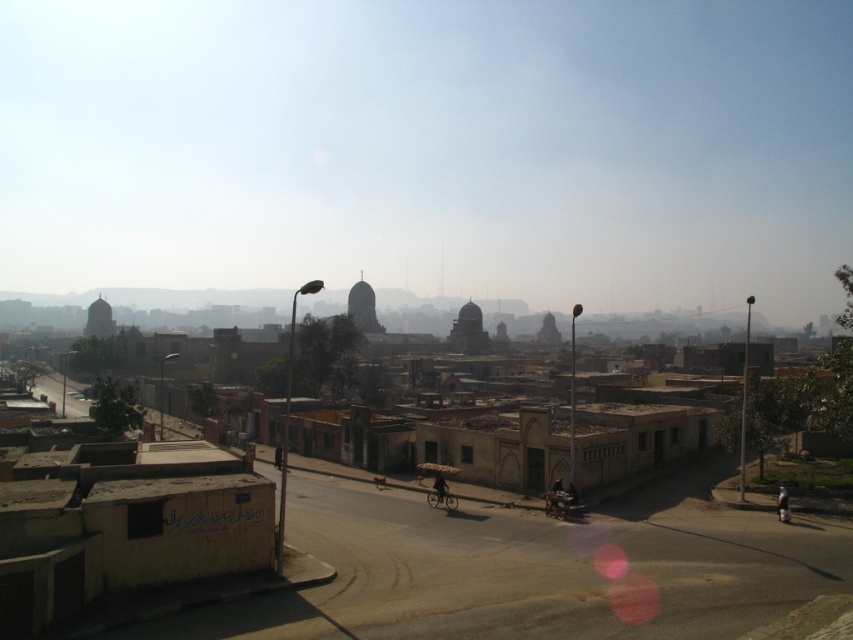
This screenshot has height=640, width=853. Find the location of `light brown fabric bag at lower right`. light brown fabric bag at lower right is located at coordinates (782, 504).

Between point (779, 500) and point (281, 461), which one is positioned in front?

Positioned in front is point (779, 500).

You are a GUI agent. You are given a task and a screenshot of the screen. Output one action in this format:
    pyautogui.click(x=<x>, y=<y>)
    Task: Click on the light brown fabric bag at lower right
    The width and height of the screenshot is (853, 640).
    Given the screenshot: What is the action you would take?
    pyautogui.click(x=782, y=504)

Does light brown fabric bag at lower right have a greater width compared to dark blue fabric bicycle at center?

No, light brown fabric bag at lower right is not wider than dark blue fabric bicycle at center.

Is point (786, 516) positioned behind point (437, 499)?

No, it is in front of (437, 499).

Between point (782, 508) and point (440, 490), which one is positioned in front?

Point (782, 508) is more forward.

Identify the location of light brown fabric bag at lower right. The image size is (853, 640). (782, 504).

This screenshot has width=853, height=640. Describe the element at coordinates (440, 486) in the screenshot. I see `dark blue fabric bicycle at center` at that location.

The height and width of the screenshot is (640, 853). Identify the location of dark blue fabric bicycle at center. (440, 486).